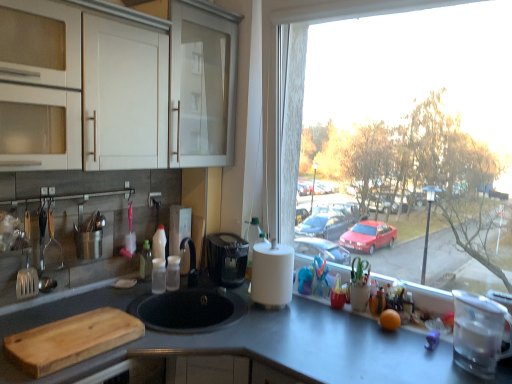
What are the coordinates of `free space on the front side of white matte paper towel at center` in the screenshot? It's located at (280, 323).